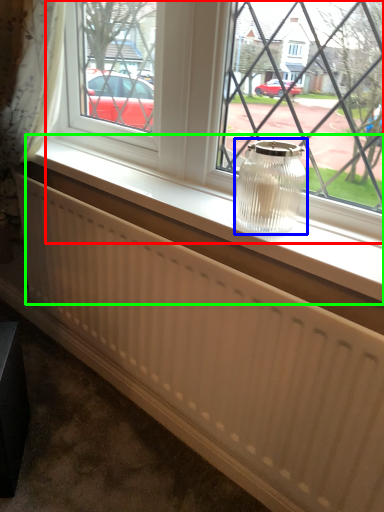
Question: Which is farther away from window (highlighted by a red box)? glass vase (highlighted by a blue box) or window sill (highlighted by a green box)?

Choices:
 (A) glass vase
 (B) window sill

Answer: (A)